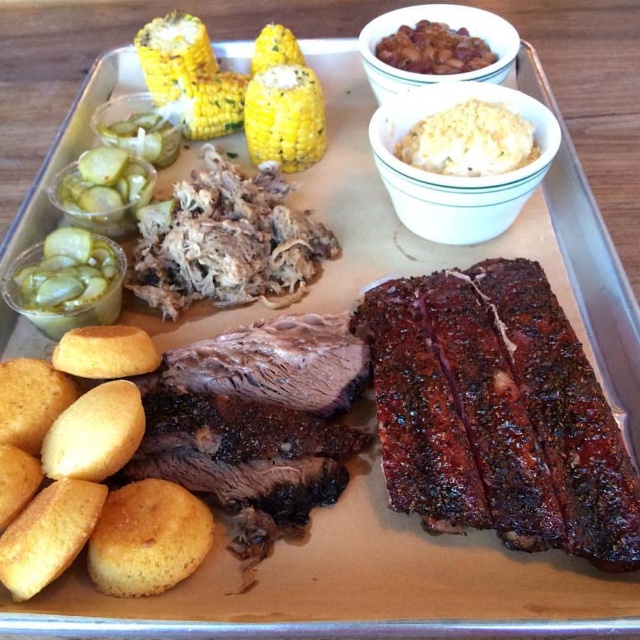
Does white creamy mashed potatoes at upper center have a greater width compared to yellow/golden corn at upper left?

Yes, white creamy mashed potatoes at upper center is wider than yellow/golden corn at upper left.

Can you confirm if white creamy mashed potatoes at upper center is positioned to the right of yellow/golden corn at upper left?

Yes, white creamy mashed potatoes at upper center is to the right of yellow/golden corn at upper left.

Locate an element on the screen. This screenshot has height=640, width=640. white creamy mashed potatoes at upper center is located at coordinates (468, 140).

Does charred wood-grain ribs at right appear on the right side of white creamy mashed potatoes at center?

In fact, charred wood-grain ribs at right is to the left of white creamy mashed potatoes at center.

Is point (429, 390) positioned before point (435, 202)?

That is True.

The image size is (640, 640). I want to click on charred wood-grain ribs at right, so click(x=497, y=412).

Can you confirm if yellowgrainy/crumblycorn at upper left is thinner than brown glossy beans at upper center?

Indeed, yellowgrainy/crumblycorn at upper left has a lesser width compared to brown glossy beans at upper center.

Can you confirm if yellowgrainy/crumblycorn at upper left is positioned above brown glossy beans at upper center?

Actually, yellowgrainy/crumblycorn at upper left is below brown glossy beans at upper center.

In order to click on yellowgrainy/crumblycorn at upper left in this screenshot , I will do `click(173, 54)`.